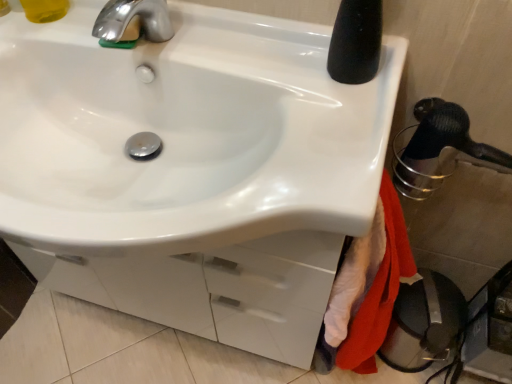
At what (x,y) coordinates should I click in order to perform the action: click on red cotton bath towel at lower right. Please return your answer as a coordinate pair (x, y). The width and height of the screenshot is (512, 384). Looking at the image, I should click on (379, 290).

The image size is (512, 384). In order to click on translucent yellow liquid at upper left in this screenshot , I will do `click(44, 10)`.

Describe the element at coordinates (44, 10) in the screenshot. I see `translucent yellow liquid at upper left` at that location.

The height and width of the screenshot is (384, 512). In order to click on white glossy sink at center in this screenshot , I will do point(186,134).

This screenshot has height=384, width=512. What are the coordinates of `red cotton bath towel at lower right` in the screenshot? It's located at (379, 290).

How much distance is there between red cotton bath towel at lower right and black rubber shower head at right?

red cotton bath towel at lower right is 18.19 centimeters from black rubber shower head at right.

Is the position of red cotton bath towel at lower right more distant than that of black rubber shower head at right?

That is False.

Does point (343, 352) appear closer or farther from the camera than point (437, 118)?

Clearly, point (343, 352) is more distant from the camera than point (437, 118).

Is red cotton bath towel at lower right to the left of black rubber shower head at right from the viewer's perspective?

Correct, you'll find red cotton bath towel at lower right to the left of black rubber shower head at right.

Is red cotton bath towel at lower right oriented away from translucent yellow liquid at upper left?

No, red cotton bath towel at lower right's orientation is not away from translucent yellow liquid at upper left.

Find the location of `bath towel below the translucent yellow liquid at upper left (from a real-world perspective)`. bath towel below the translucent yellow liquid at upper left (from a real-world perspective) is located at coordinates (379, 290).

From the image's perspective, which object appears higher, red cotton bath towel at lower right or translucent yellow liquid at upper left?

translucent yellow liquid at upper left, from the image's perspective.

Does red cotton bath towel at lower right have a larger size compared to white glossy sink at center?

No, red cotton bath towel at lower right is not bigger than white glossy sink at center.

How many degrees apart are the facing directions of red cotton bath towel at lower right and white glossy sink at center?

red cotton bath towel at lower right and white glossy sink at center are facing 90 degrees away from each other.

Is red cotton bath towel at lower right inside or outside of white glossy sink at center?

red cotton bath towel at lower right is not enclosed by white glossy sink at center.

What are the coordinates of `sink in front of the red cotton bath towel at lower right` in the screenshot? It's located at click(186, 134).

Can you confirm if white glossy sink at center is bigger than black rubber shower head at right?

Yes, white glossy sink at center is bigger than black rubber shower head at right.

From the image's perspective, is white glossy sink at center on top of black rubber shower head at right?

Answer: Yes, from the image's perspective, white glossy sink at center is on top of black rubber shower head at right.

Is white glossy sink at center aimed at black rubber shower head at right?

No.

How many degrees apart are the facing directions of white glossy sink at center and black rubber shower head at right?

0.00019 degrees.

From the image's perspective, relative to translucent yellow liquid at upper left, is black rubber shower head at right above or below?

black rubber shower head at right is situated lower than translucent yellow liquid at upper left in the image.

What's the angular difference between black rubber shower head at right and translucent yellow liquid at upper left's facing directions?

0.000275 degrees.

Is black rubber shower head at right facing away from translucent yellow liquid at upper left?

black rubber shower head at right is not turned away from translucent yellow liquid at upper left.

Locate an element on the screen. liquid that is above the black rubber shower head at right (from the image's perspective) is located at coordinates (44, 10).

Considering the sizes of objects shiny metallic faucet at upper left and white glossy sink at center in the image provided, who is taller, shiny metallic faucet at upper left or white glossy sink at center?

With more height is white glossy sink at center.

From the image's perspective, would you say shiny metallic faucet at upper left is shown under white glossy sink at center?

Actually, shiny metallic faucet at upper left appears above white glossy sink at center in the image.

Measure the distance from shiny metallic faucet at upper left to white glossy sink at center.

shiny metallic faucet at upper left is 21.14 centimeters from white glossy sink at center.

Considering the sizes of objects shiny metallic faucet at upper left and white glossy sink at center in the image provided, who is wider, shiny metallic faucet at upper left or white glossy sink at center?

With larger width is white glossy sink at center.

The image size is (512, 384). What are the coordinates of `sink on the right of shiny metallic faucet at upper left` in the screenshot? It's located at (186, 134).

Is there a large distance between white glossy sink at center and shiny metallic faucet at upper left?

white glossy sink at center is near shiny metallic faucet at upper left, not far away.

Is shiny metallic faucet at upper left located within white glossy sink at center?

Yes.

Is white glossy sink at center to the left or to the right of shiny metallic faucet at upper left in the image?

Based on their positions, white glossy sink at center is located to the right of shiny metallic faucet at upper left.

I want to click on bath towel in front of the black rubber shower head at right, so click(x=379, y=290).

At what (x,y) coordinates should I click in order to perform the action: click on liquid on the left of red cotton bath towel at lower right. Please return your answer as a coordinate pair (x, y). The width and height of the screenshot is (512, 384). Looking at the image, I should click on (44, 10).

Which object lies nearer to the anchor point black rubber shower head at right, translucent yellow liquid at upper left or shiny metallic faucet at upper left?

shiny metallic faucet at upper left is closer to black rubber shower head at right.

Considering their positions, is red cotton bath towel at lower right positioned further to white glossy sink at center than black rubber shower head at right?

black rubber shower head at right is further to white glossy sink at center.

Which object lies nearer to the anchor point black rubber shower head at right, red cotton bath towel at lower right or shiny metallic faucet at upper left?

red cotton bath towel at lower right lies closer to black rubber shower head at right than the other object.

Considering their positions, is white glossy sink at center positioned further to red cotton bath towel at lower right than black rubber shower head at right?

white glossy sink at center is further to red cotton bath towel at lower right.

From the picture: When comparing their distances from shiny metallic faucet at upper left, does black rubber shower head at right or white glossy sink at center seem closer?

Among the two, white glossy sink at center is located nearer to shiny metallic faucet at upper left.

When comparing their distances from translucent yellow liquid at upper left, does black rubber shower head at right or shiny metallic faucet at upper left seem closer?

shiny metallic faucet at upper left.

From the image, which object appears to be farther from translucent yellow liquid at upper left, white glossy sink at center or black rubber shower head at right?

black rubber shower head at right is positioned further to the anchor translucent yellow liquid at upper left.

Estimate the real-world distances between objects in this image. Which object is further from red cotton bath towel at lower right, black rubber shower head at right or translucent yellow liquid at upper left?

The object further to red cotton bath towel at lower right is translucent yellow liquid at upper left.

This screenshot has height=384, width=512. In order to click on bath towel located between shiny metallic faucet at upper left and black rubber shower head at right in the left-right direction in this screenshot , I will do `click(379, 290)`.

Locate an element on the screen. sink that lies between shiny metallic faucet at upper left and red cotton bath towel at lower right from top to bottom is located at coordinates (186, 134).

You are a GUI agent. You are given a task and a screenshot of the screen. Output one action in this format:
    pyautogui.click(x=<x>, y=<y>)
    Task: Click on the sink between translucent yellow liquid at upper left and red cotton bath towel at lower right vertically
    
    Given the screenshot: What is the action you would take?
    tap(186, 134)

The image size is (512, 384). Find the location of `bath towel located between white glossy sink at center and black rubber shower head at right in the left-right direction`. bath towel located between white glossy sink at center and black rubber shower head at right in the left-right direction is located at coordinates (379, 290).